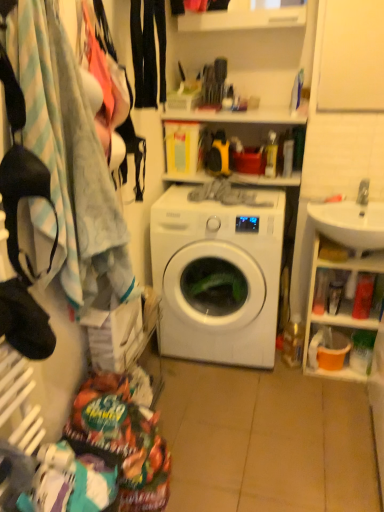
Question: Considering the positions of point (225, 333) and point (327, 314), is point (225, 333) closer or farther from the camera than point (327, 314)?

Choices:
 (A) farther
 (B) closer

Answer: (B)

Question: Is white glossy washing machine at center situated inside white glossy cabinet at right or outside?

Choices:
 (A) inside
 (B) outside

Answer: (B)

Question: Which is farther from the black smooth pants at upper center?

Choices:
 (A) white glossy cabinet at right
 (B) white glossy sink at right
 (C) white glossy washing machine at center

Answer: (A)

Question: Which object is the farthest from the black smooth pants at upper center?

Choices:
 (A) white glossy cabinet at right
 (B) white glossy washing machine at center
 (C) white glossy sink at right

Answer: (A)